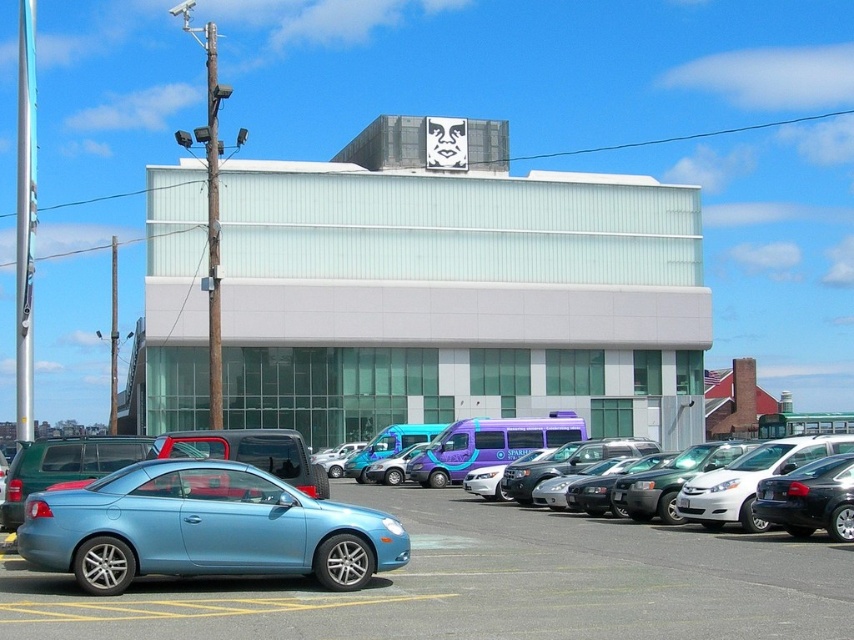
Question: Is light blue car at center-left below light blue metallic car at lower left?

Choices:
 (A) no
 (B) yes

Answer: (B)

Question: Among these objects, which one is nearest to the camera?

Choices:
 (A) light blue metallic car at lower left
 (B) light blue car at center-left

Answer: (B)

Question: Is light blue car at center-left in front of light blue metallic car at lower left?

Choices:
 (A) no
 (B) yes

Answer: (B)

Question: Is light blue car at center-left thinner than light blue metallic car at lower left?

Choices:
 (A) no
 (B) yes

Answer: (A)